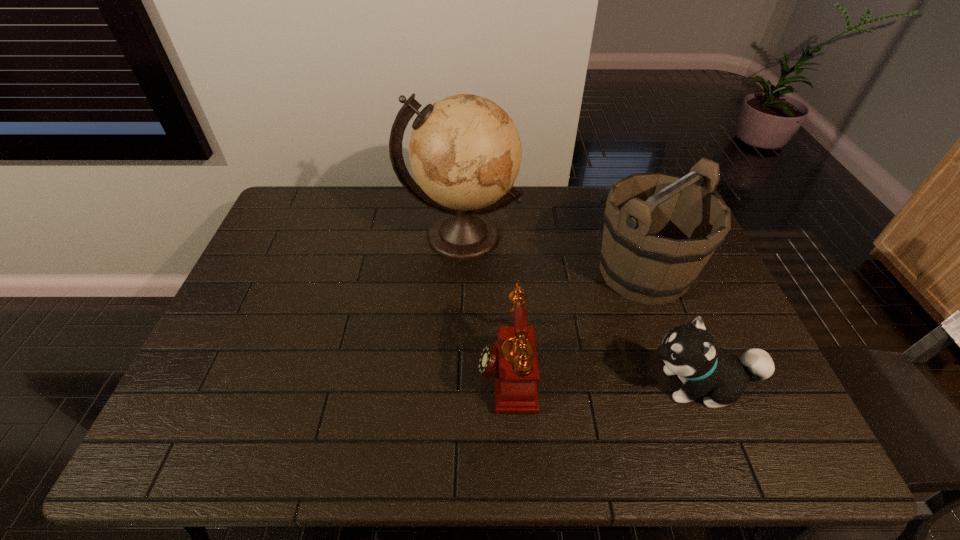
This screenshot has width=960, height=540. Identify the location of free region that satisfies the following two spatial constraints: 1. on the front-facing side of the third shortest object; 2. on the right side of the tallest object. (460, 272).